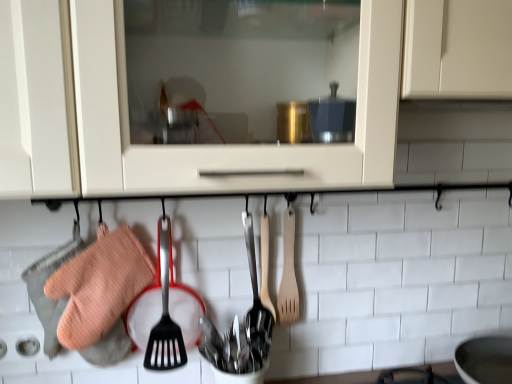
Question: From a real-world perspective, is wooden spatula at center, which is the second spatula in right-to-left order, on top of orange waffle oven mitt at left?

Choices:
 (A) yes
 (B) no

Answer: (A)

Question: Is wooden spatula at center, the first spatula positioned from the left, not near orange waffle oven mitt at left?

Choices:
 (A) yes
 (B) no

Answer: (B)

Question: Considering the relative sizes of wooden spatula at center, which is the second spatula in right-to-left order, and orange waffle oven mitt at left in the image provided, is wooden spatula at center, which is the second spatula in right-to-left order, smaller than orange waffle oven mitt at left?

Choices:
 (A) no
 (B) yes

Answer: (B)

Question: Can you confirm if wooden spatula at center, which is the second spatula in right-to-left order, is shorter than orange waffle oven mitt at left?

Choices:
 (A) no
 (B) yes

Answer: (B)

Question: From a real-world perspective, is wooden spatula at center, the first spatula positioned from the left, physically below orange waffle oven mitt at left?

Choices:
 (A) no
 (B) yes

Answer: (A)

Question: Is wooden spatula at center, the first spatula positioned from the left, turned away from orange waffle oven mitt at left?

Choices:
 (A) no
 (B) yes

Answer: (A)

Question: Is wooden spatula at center-right, which ranks as the first spatula in right-to-left order, beside orange waffle oven mitt at left?

Choices:
 (A) yes
 (B) no

Answer: (B)

Question: From a real-world perspective, is wooden spatula at center-right, the second spatula positioned from the left, beneath orange waffle oven mitt at left?

Choices:
 (A) yes
 (B) no

Answer: (B)

Question: Is wooden spatula at center-right, the second spatula positioned from the left, not inside orange waffle oven mitt at left?

Choices:
 (A) no
 (B) yes

Answer: (B)

Question: From the image's perspective, is wooden spatula at center-right, which ranks as the first spatula in right-to-left order, above orange waffle oven mitt at left?

Choices:
 (A) yes
 (B) no

Answer: (A)

Question: From the image's perspective, is wooden spatula at center-right, the second spatula positioned from the left, below orange waffle oven mitt at left?

Choices:
 (A) yes
 (B) no

Answer: (B)

Question: Are wooden spatula at center-right, which ranks as the first spatula in right-to-left order, and orange waffle oven mitt at left located far from each other?

Choices:
 (A) no
 (B) yes

Answer: (A)

Question: Is orange waffle oven mitt at left at the right side of polished stainless steel cutlery at center, marked as the first silverware in a bottom-to-top arrangement?

Choices:
 (A) no
 (B) yes

Answer: (A)